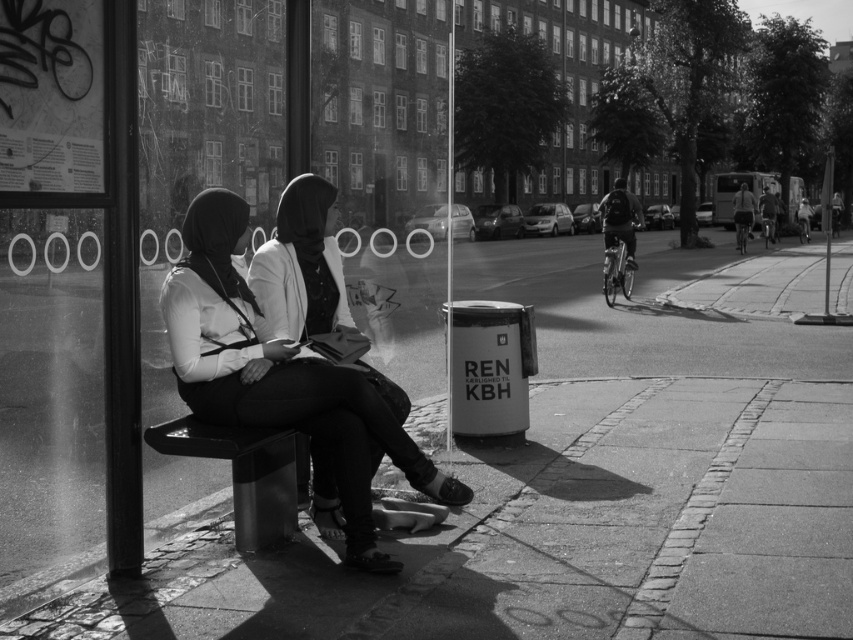
Who is more distant from viewer, (257, 474) or (740, 236)?

The point (740, 236) is behind.

Describe the element at coordinates (247, 474) in the screenshot. I see `metallic polished bench at lower left` at that location.

Locate an element on the screen. This screenshot has width=853, height=640. metallic polished bench at lower left is located at coordinates (247, 474).

You are a GUI agent. You are given a task and a screenshot of the screen. Output one action in this format:
    pyautogui.click(x=<x>, y=<y>)
    Task: Click on the metallic polished bench at lower left
    
    Given the screenshot: What is the action you would take?
    pyautogui.click(x=247, y=474)

Image resolution: width=853 pixels, height=640 pixels. What do you see at coordinates (283, 384) in the screenshot?
I see `smooth leather jacket at center` at bounding box center [283, 384].

Does smooth leather jacket at center appear on the left side of dark fabric jacket at right?

Yes, smooth leather jacket at center is to the left of dark fabric jacket at right.

The height and width of the screenshot is (640, 853). In order to click on smooth leather jacket at center in this screenshot , I will do `click(283, 384)`.

Find the location of a particular element. smooth leather jacket at center is located at coordinates (283, 384).

Can you confirm if light brown leather jacket at right is smaller than dark gray fabric jacket at center right?

Yes.

Does light brown leather jacket at right appear on the right side of dark gray fabric jacket at center right?

No, light brown leather jacket at right is not to the right of dark gray fabric jacket at center right.

Which is behind, point (749, 225) or point (766, 240)?

The point (766, 240) is behind.

Identify the location of light brown leather jacket at right. (741, 216).